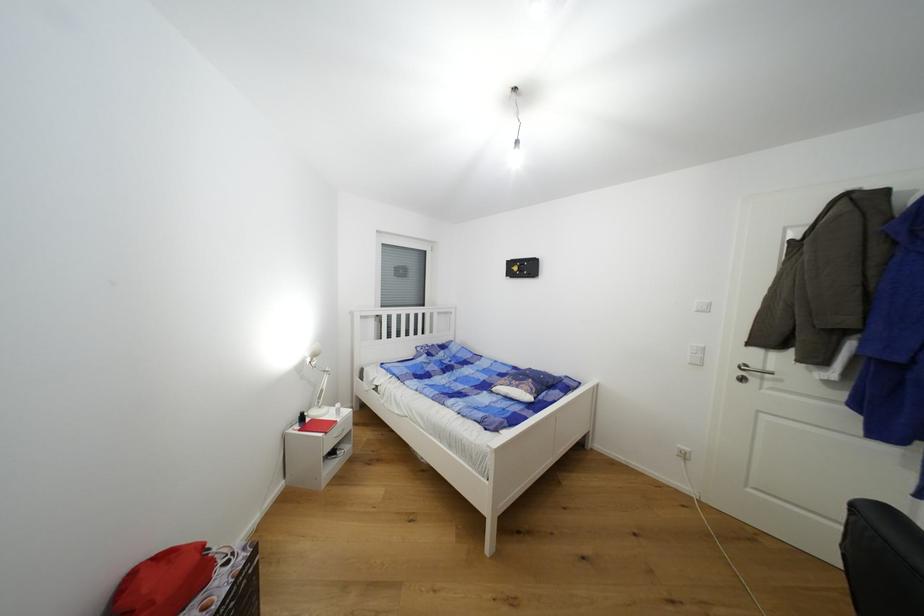
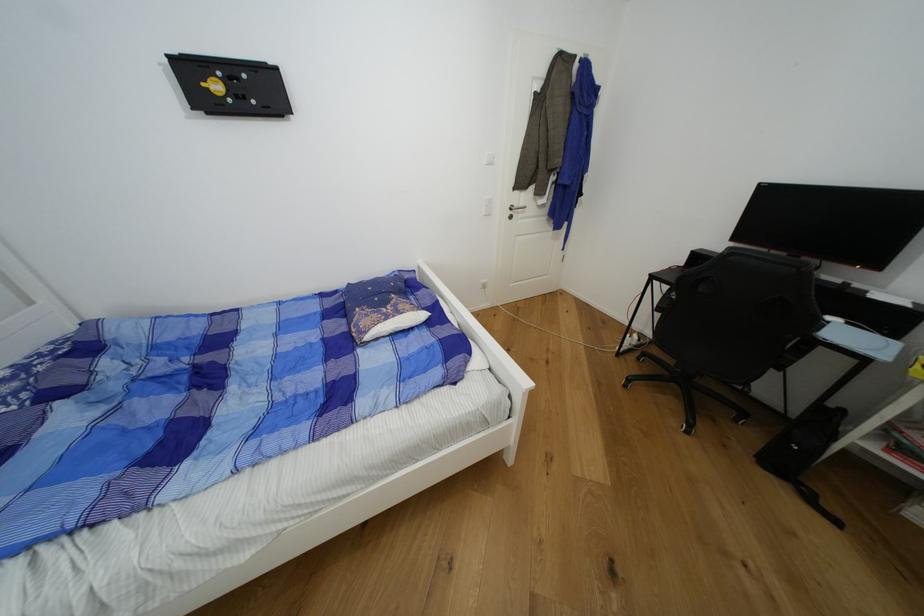
In the second image, find the point that corresponds to (x=523, y=387) in the first image.

(404, 314)